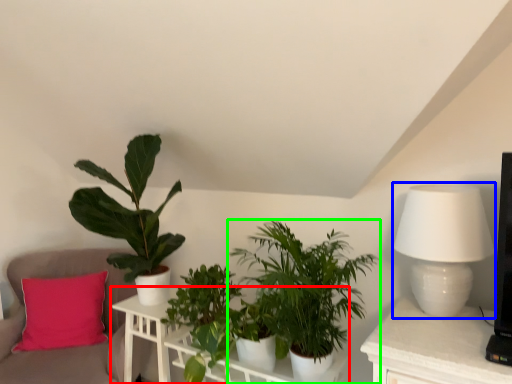
Question: Estimate the real-world distances between objects in this image. Which object is farther from table (highlighted by a red box), table lamp (highlighted by a blue box) or houseplant (highlighted by a green box)?

Choices:
 (A) table lamp
 (B) houseplant

Answer: (A)